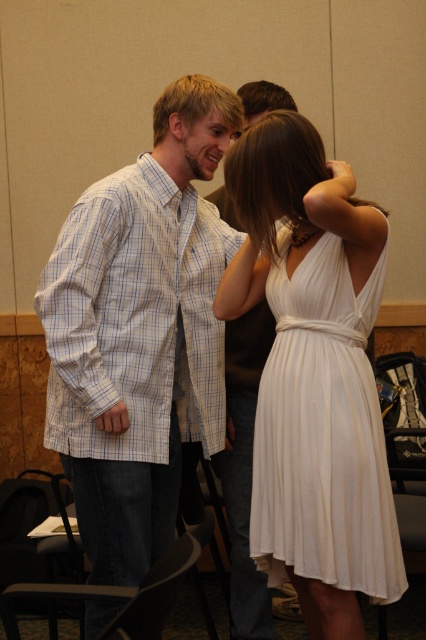
Who is positioned more to the right, white pleated dress at center or light blue plaid shirt at center?

From the viewer's perspective, white pleated dress at center appears more on the right side.

Is white pleated dress at center wider than light blue plaid shirt at center?

Yes.

Locate an element on the screen. The width and height of the screenshot is (426, 640). white pleated dress at center is located at coordinates (322, 433).

Where is `white pleated dress at center`? white pleated dress at center is located at coordinates (322, 433).

Can you confirm if checkered fabric shirt at center is smaller than light blue plaid shirt at center?

Incorrect, checkered fabric shirt at center is not smaller in size than light blue plaid shirt at center.

Describe the element at coordinates (134, 314) in the screenshot. I see `checkered fabric shirt at center` at that location.

Identify the location of checkered fabric shirt at center. Image resolution: width=426 pixels, height=640 pixels. (134, 314).

How distant is checkered fabric shirt at center from white pleated dress at center?

checkered fabric shirt at center is 18.04 inches away from white pleated dress at center.

Who is more distant from viewer, (x=144, y=432) or (x=319, y=529)?

Positioned behind is point (x=144, y=432).

Where is `checkered fabric shirt at center`? This screenshot has width=426, height=640. checkered fabric shirt at center is located at coordinates (134, 314).